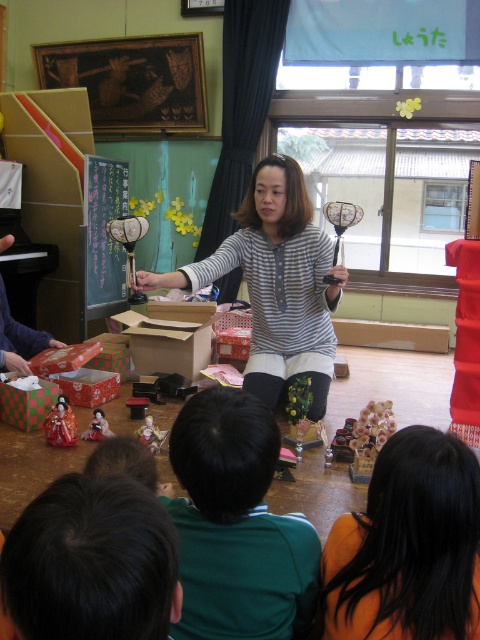
Question: Which point is closer to the camera taking this photo?

Choices:
 (A) (29, 371)
 (B) (10, 410)
 (C) (110, 317)
 (D) (95, 417)

Answer: (D)

Question: Among these points, which one is nearest to the camera?

Choices:
 (A) (415, 465)
 (B) (322, 232)
 (C) (38, 422)

Answer: (A)

Question: Which is nearer to the matte black doll at left?

Choices:
 (A) cardboard box at center
 (B) green checkered paper box at lower left
 (C) black matte hair at lower center
 (D) striped fabric at center

Answer: (B)

Question: Observing the image, what is the correct spatial positioning of green fabric shirt at lower center in reference to matte wooden doll at lower center?

Choices:
 (A) above
 (B) below

Answer: (A)

Question: Can you confirm if green fabric shirt at lower center is bigger than matte porcelain doll at lower left?

Choices:
 (A) no
 (B) yes

Answer: (B)

Question: Is matte wooden doll at lower center to the left of matte plastic doll at lower left from the viewer's perspective?

Choices:
 (A) yes
 (B) no

Answer: (B)